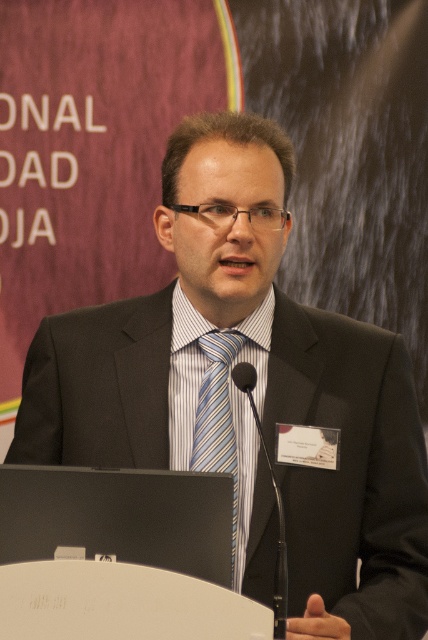
You are a photographer preparing to take a closeup shot of the speaker. You need to focus on either the striped cotton dress shirt at center or the blue striped tie at center. Which one is wider and should you focus on to capture more detail?

The striped cotton dress shirt at center is wider than the blue striped tie at center, so focusing on the striped cotton dress shirt at center will allow you to capture more detail.

You are an event organizer setting up a camera to capture both the man at the podium and the banner in the background. The camera is positioned at a point equidistant between point (252, 468) and point (217, 448). Which point is closer to the camera lens?

Point (252, 468) is further to the viewer than point (217, 448). Since the camera is placed equidistant between them, the point closer to the lens would be the one further away from the camera position. Wait, no, actually, if the camera is equidistant between the two points, then both are equally distant from the lens. Hmm, maybe I need to think differently. The description says point A is further to the viewer than point B. So if the camera is between them, then the distance from the camera to each is